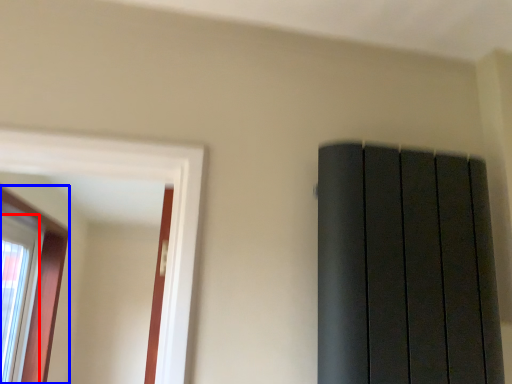
Question: Which point is closer to the camera, window (highlighted by a red box) or window (highlighted by a blue box)?

Choices:
 (A) window
 (B) window

Answer: (B)